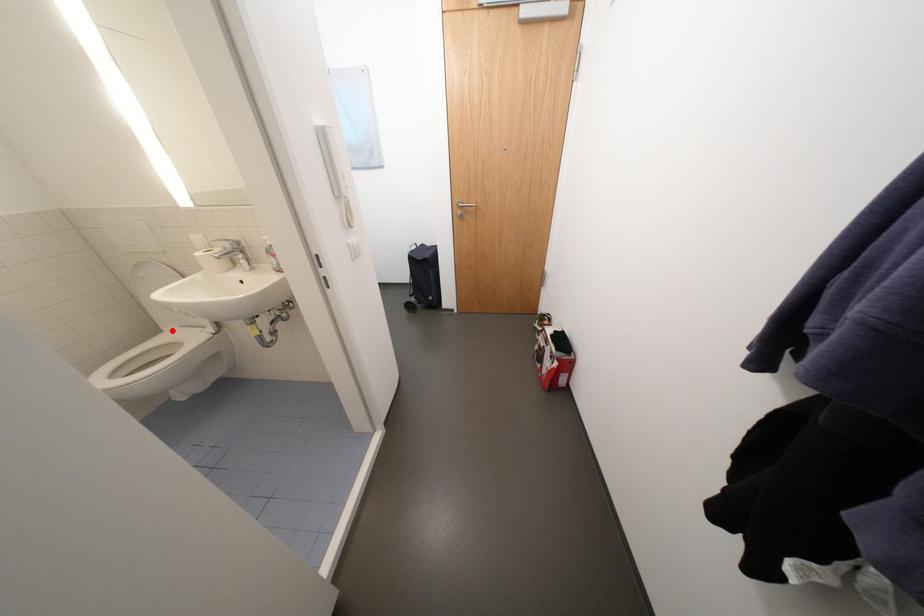
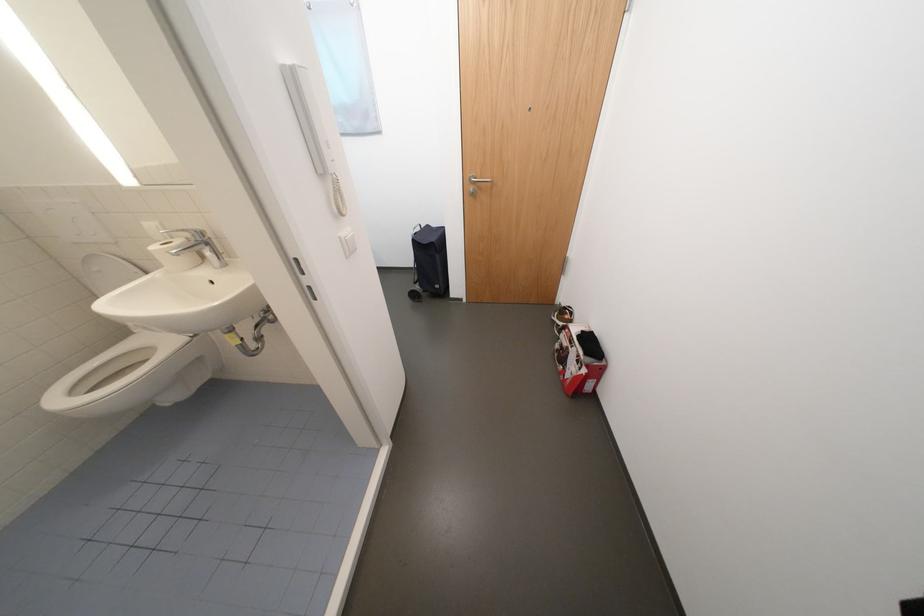
Where in the second image is the point corresponding to the highlighted location from the first image?

(142, 333)